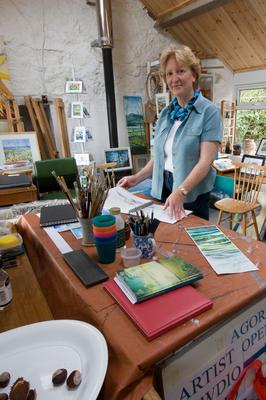
Identify the location of wall. [84, 60], [257, 76].